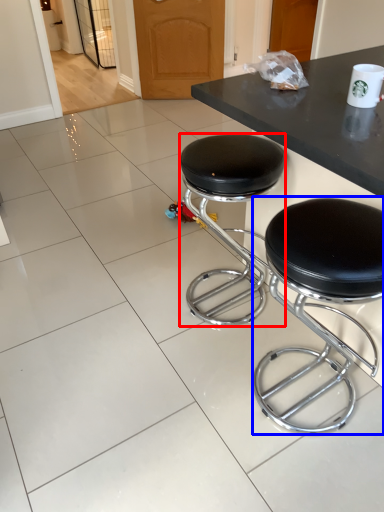
Question: Which point is closer to the camera, stool (highlighted by a red box) or stool (highlighted by a blue box)?

Choices:
 (A) stool
 (B) stool

Answer: (B)